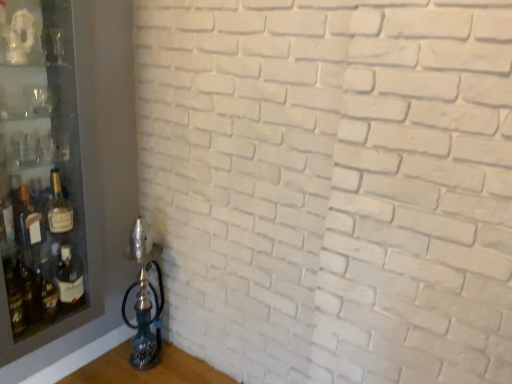
Question: Is transparent glass shelf at left shorter than matte glass bottle at left?

Choices:
 (A) no
 (B) yes

Answer: (A)

Question: Is transparent glass shelf at left bigger than matte glass bottle at left?

Choices:
 (A) no
 (B) yes

Answer: (B)

Question: From a real-world perspective, is transparent glass shelf at left on top of matte glass bottle at left?

Choices:
 (A) no
 (B) yes

Answer: (B)

Question: Considering the relative positions of transparent glass shelf at left and matte glass bottle at left in the image provided, is transparent glass shelf at left to the left of matte glass bottle at left from the viewer's perspective?

Choices:
 (A) no
 (B) yes

Answer: (B)

Question: Is transparent glass shelf at left positioned with its back to matte glass bottle at left?

Choices:
 (A) no
 (B) yes

Answer: (B)

Question: Is transparent glass shelf at left positioned far away from matte glass bottle at left?

Choices:
 (A) yes
 (B) no

Answer: (B)

Question: Is matte glass bottle at left bigger than transparent glass shelf at left?

Choices:
 (A) yes
 (B) no

Answer: (B)

Question: Are matte glass bottle at left and transparent glass shelf at left located far from each other?

Choices:
 (A) yes
 (B) no

Answer: (B)

Question: Does matte glass bottle at left have a greater width compared to transparent glass shelf at left?

Choices:
 (A) no
 (B) yes

Answer: (A)

Question: Considering the relative positions of matte glass bottle at left and transparent glass shelf at left in the image provided, is matte glass bottle at left to the left of transparent glass shelf at left from the viewer's perspective?

Choices:
 (A) yes
 (B) no

Answer: (B)

Question: Would you say matte glass bottle at left contains transparent glass shelf at left?

Choices:
 (A) no
 (B) yes

Answer: (A)

Question: Considering the relative sizes of matte glass bottle at left and transparent glass shelf at left in the image provided, is matte glass bottle at left shorter than transparent glass shelf at left?

Choices:
 (A) yes
 (B) no

Answer: (A)

Question: From their relative heights in the image, would you say transparent glass shelf at left is taller or shorter than matte glass bottle at left?

Choices:
 (A) short
 (B) tall

Answer: (B)